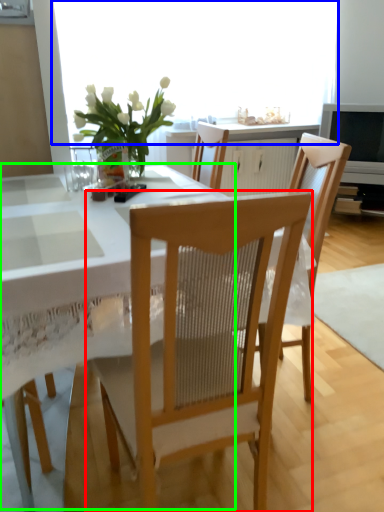
Question: Which is nearer to the chair (highlighted by a red box)? window screen (highlighted by a blue box) or table (highlighted by a green box).

Choices:
 (A) window screen
 (B) table

Answer: (B)